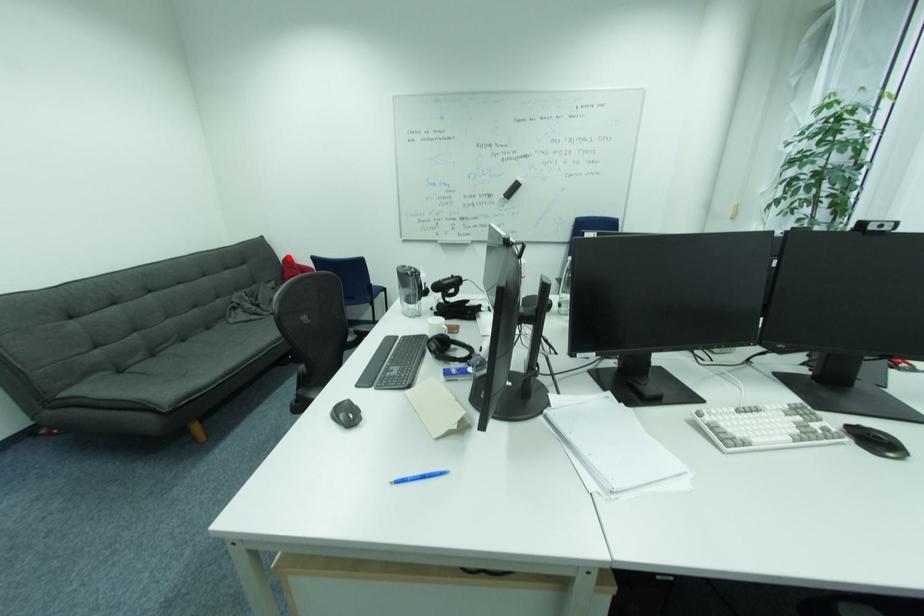
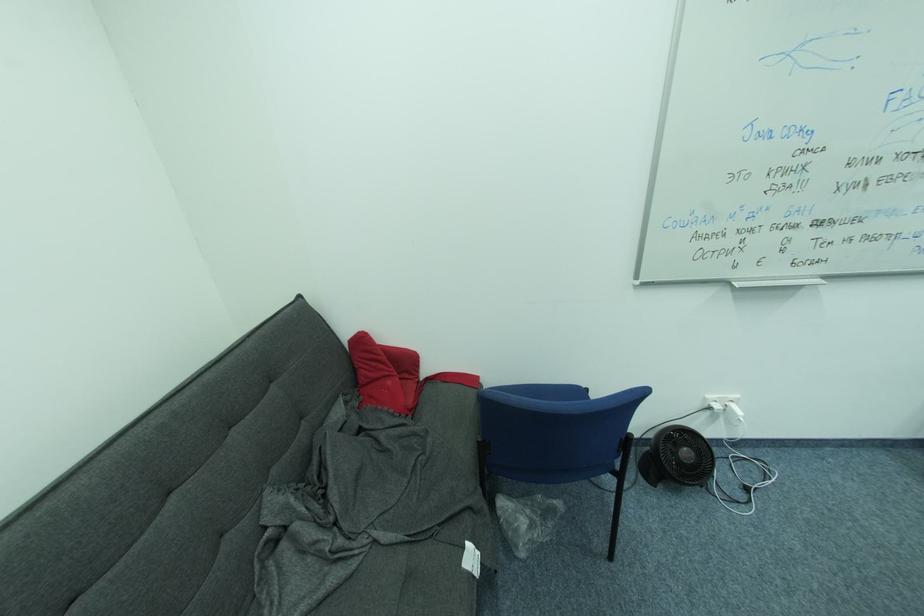
Find the pixel in the second image that matches the highlighted location in the first image.

(353, 336)